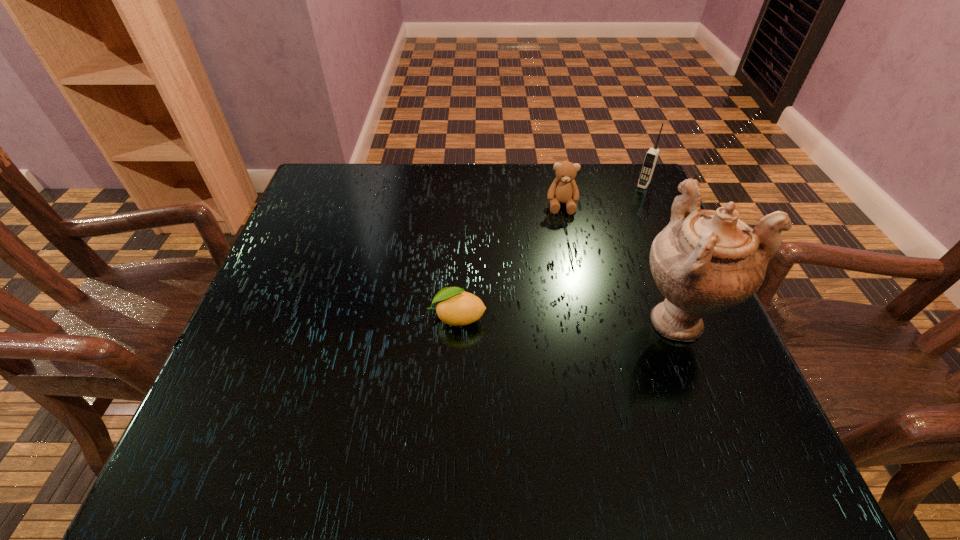
Identify the location of free space located on the back of the urn. The height and width of the screenshot is (540, 960). tap(623, 182).

You are a GUI agent. You are given a task and a screenshot of the screen. Output one action in this format:
    pyautogui.click(x=<x>, y=<y>)
    Task: Click on the vacant space located on the front-facing side of the farthest object
    
    Given the screenshot: What is the action you would take?
    pyautogui.click(x=617, y=223)

I want to click on vacant region located 0.090m on the front-facing side of the farthest object, so click(629, 206).

This screenshot has height=540, width=960. I want to click on vacant space located 0.100m on the front-facing side of the farthest object, so click(x=628, y=208).

This screenshot has width=960, height=540. Find the location of `vacant position located on the front-facing side of the teddy bear`. vacant position located on the front-facing side of the teddy bear is located at coordinates (565, 261).

What are the coordinates of `free point located on the front-facing side of the teddy bear` in the screenshot? It's located at (570, 343).

The image size is (960, 540). In order to click on vacant space located on the front-facing side of the teddy bear in this screenshot , I will do `click(569, 330)`.

This screenshot has width=960, height=540. What are the coordinates of `cellular telephone at the far edge` in the screenshot? It's located at (651, 157).

Find the location of a particular element. The width and height of the screenshot is (960, 540). teddy bear positioned at the far edge is located at coordinates (563, 190).

Where is `urn that is at the right edge`? The height and width of the screenshot is (540, 960). urn that is at the right edge is located at coordinates (704, 261).